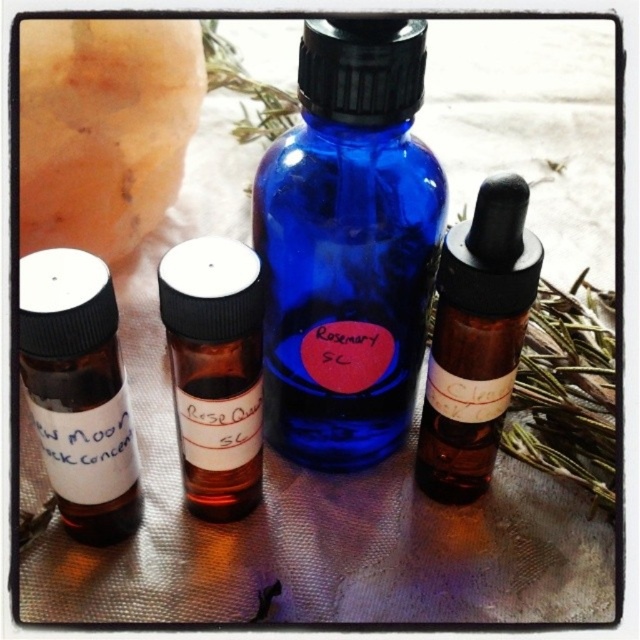
Looking at this image, you are organizing a chemistry lab and need to choose a vial for a solution that requires a wider neck for easy pouring. Based on the image, which vial would you select between the white matte vial at left and the amber glass vial at center?

The amber glass vial at center has a wider neck than the white matte vial at left, so it is better for easy pouring.